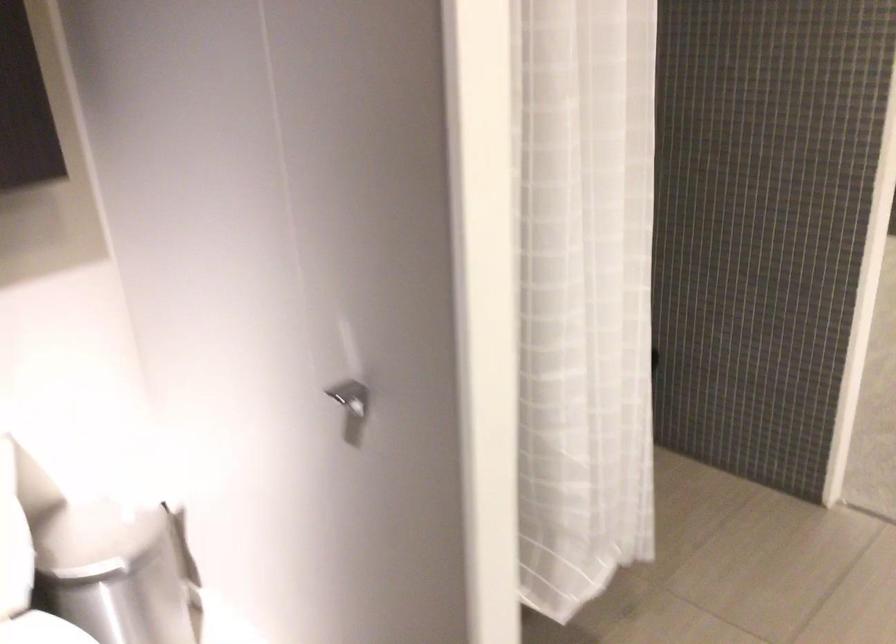
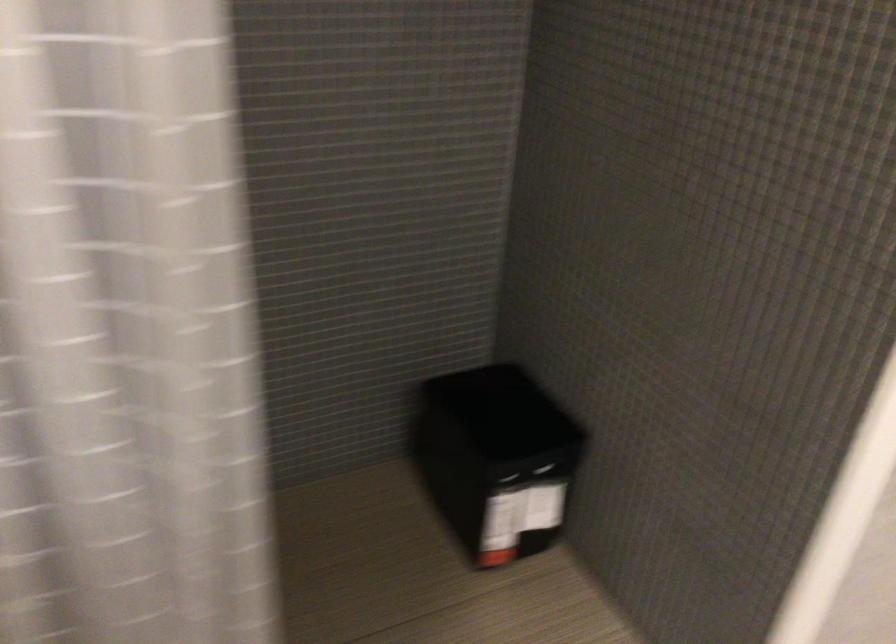
Which direction would the cameraman need to move to produce the second image?

The movement direction of the cameraman is right, forward.